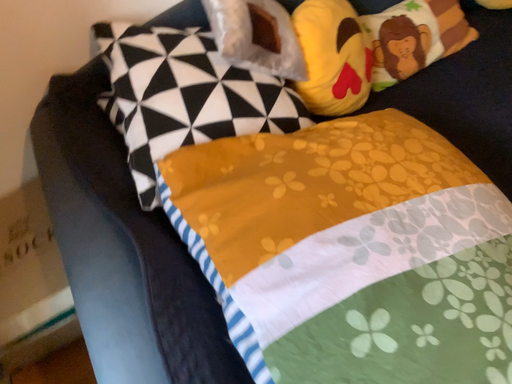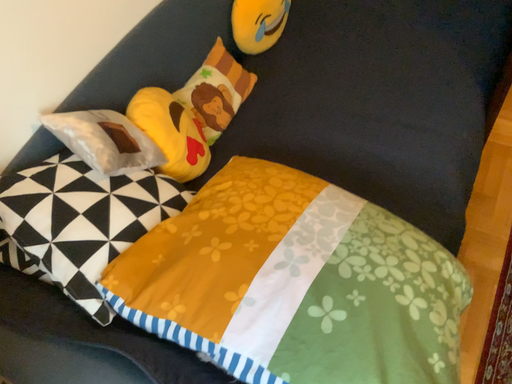
Question: How did the camera likely rotate when shooting the video?

Choices:
 (A) rotated upward
 (B) rotated downward

Answer: (A)